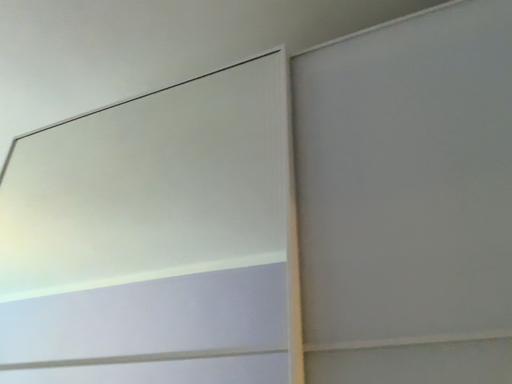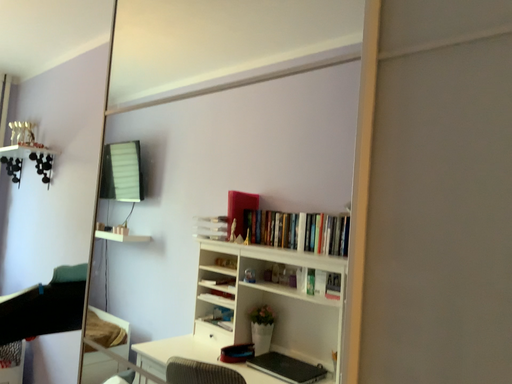
Question: How did the camera likely rotate when shooting the video?

Choices:
 (A) rotated right
 (B) rotated left

Answer: (B)